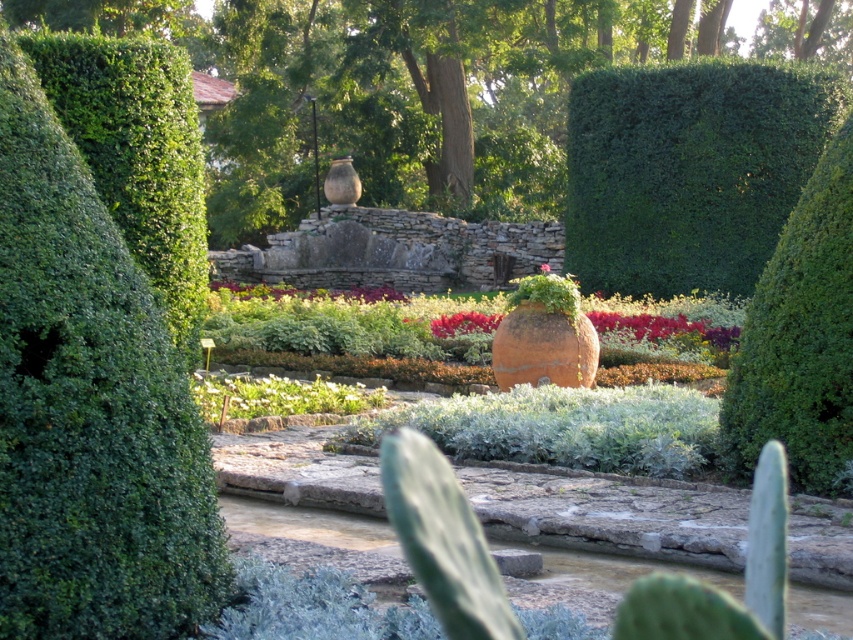
Question: Among these objects, which one is farthest from the camera?

Choices:
 (A) red matte flower at center
 (B) green leafy plant at center

Answer: (A)

Question: Considering the relative positions of green leafy hedge at upper right and pink matte flower at center in the image provided, where is green leafy hedge at upper right located with respect to pink matte flower at center?

Choices:
 (A) above
 (B) below

Answer: (A)

Question: Considering the relative positions of green leafy bush at left and green leafy bush at right in the image provided, where is green leafy bush at left located with respect to green leafy bush at right?

Choices:
 (A) below
 (B) above

Answer: (B)

Question: Is green leafy hedge at upper right wider than matte terracotta vase at center?

Choices:
 (A) yes
 (B) no

Answer: (B)

Question: Which point is closer to the camera taking this photo?

Choices:
 (A) (706, 358)
 (B) (111, 182)
 (C) (540, 268)
 (D) (735, 77)

Answer: (B)

Question: Estimate the real-world distances between objects in this image. Which object is closer to the green leafy hedge at upper right?

Choices:
 (A) red matte flower at center
 (B) green leafy plant at center

Answer: (A)